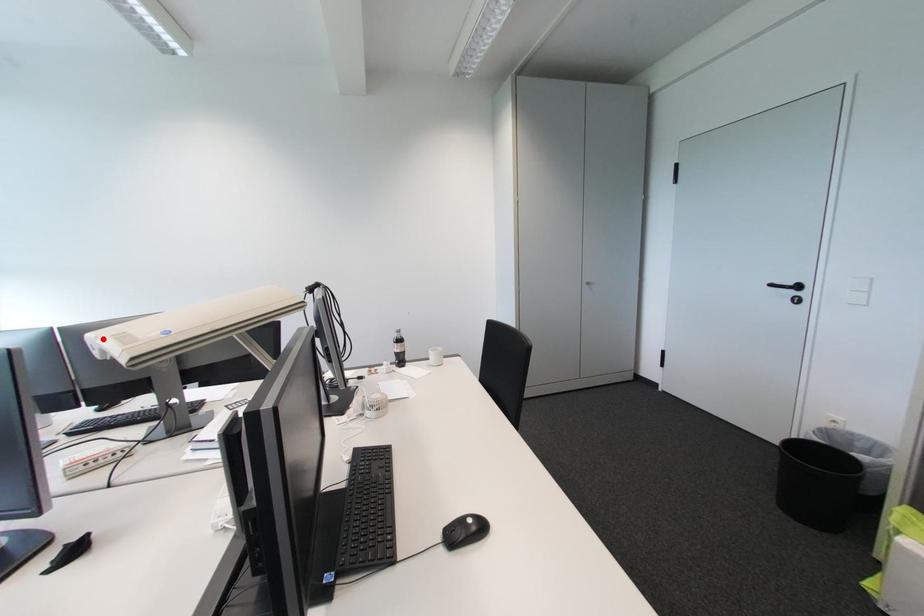
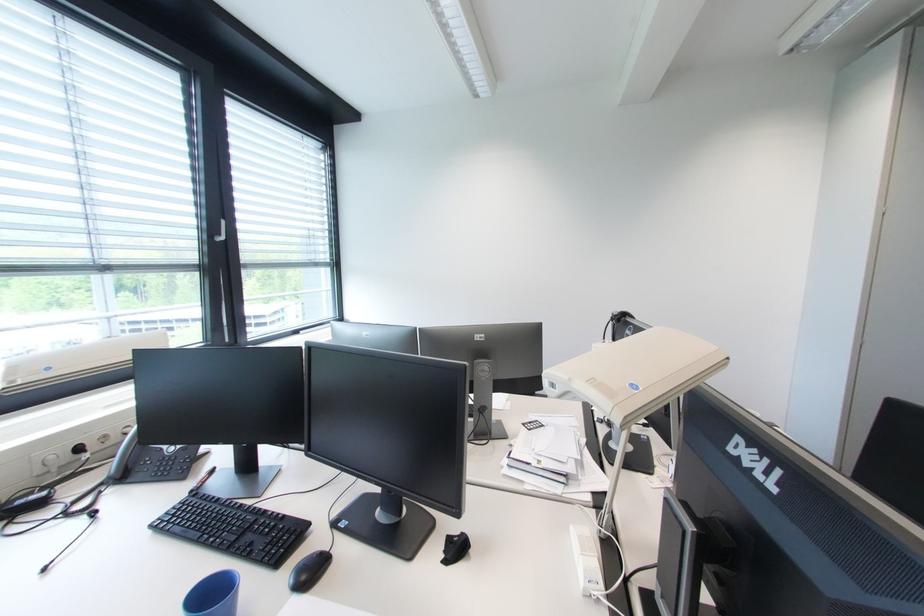
Question: I am providing you with two images of the same scene from different viewpoints. A red point is marked on the first image. Can you still see the location of the red point in image 2?

Choices:
 (A) Yes
 (B) No

Answer: (A)